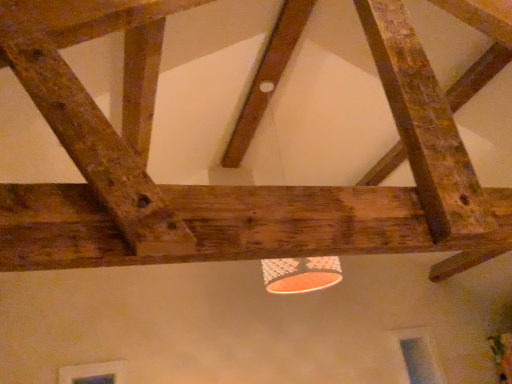
Question: Which is correct: rustic wood beam at upper right, marked as the 1th plank in a right-to-left arrangement, is inside rustic wood beam at upper center, which is the first plank in left-to-right order, or outside of it?

Choices:
 (A) outside
 (B) inside

Answer: (A)

Question: Is point (413, 99) positioned closer to the camera than point (141, 213)?

Choices:
 (A) closer
 (B) farther

Answer: (B)

Question: Which object is the closest to the rustic wood beam at upper right, acting as the 2th plank starting from the front?

Choices:
 (A) rustic wood beam at upper center, which is the first plank in left-to-right order
 (B) rustic wood beam at center, the 3th plank in the front-to-back sequence

Answer: (A)

Question: Which of these objects is positioned farthest from the rustic wood beam at center, acting as the 1th plank starting from the back?

Choices:
 (A) rustic wood beam at upper center, the first plank positioned from the front
 (B) rustic wood beam at upper right, marked as the 1th plank in a right-to-left arrangement

Answer: (A)